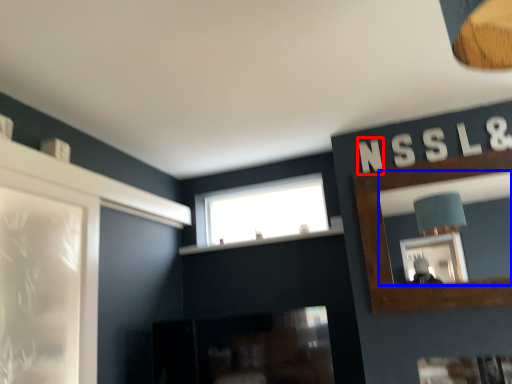
Question: Which object appears closest to the camera in this image, letter (highlighted by a red box) or mirror (highlighted by a blue box)?

Choices:
 (A) letter
 (B) mirror

Answer: (B)